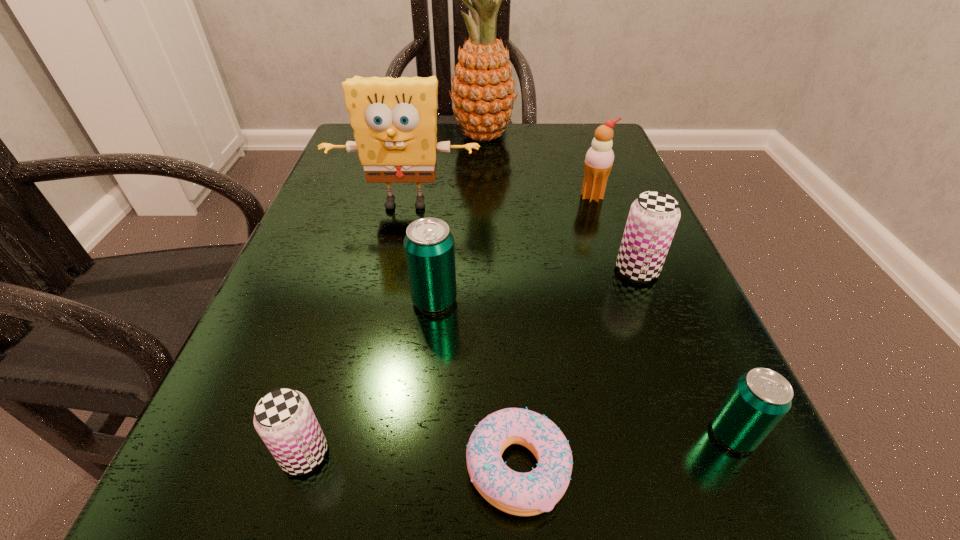
Find the location of a particular element. This screenshot has width=960, height=540. the right teal beer can is located at coordinates (759, 399).

I want to click on the nearer teal beer can, so click(x=759, y=399).

Identify the location of purple doughnut. Image resolution: width=960 pixels, height=540 pixels. [x=522, y=494].

The image size is (960, 540). I want to click on the shortest object, so click(522, 494).

In order to click on vacant space positioned on the front of the farthest object in this screenshot , I will do `click(484, 192)`.

You are a GUI agent. You are given a task and a screenshot of the screen. Output one action in this format:
    pyautogui.click(x=<x>, y=<y>)
    Task: Click on the vacant space located on the face of the second tallest object
    The height and width of the screenshot is (540, 960).
    Given the screenshot: What is the action you would take?
    pyautogui.click(x=385, y=300)

I want to click on free point located 0.280m at the front with a straw on the icecream, so click(x=631, y=310).

At what (x,y) coordinates should I click in order to perform the action: click on vacant space located 0.370m on the left of the right purple beer can. Please return your answer as a coordinate pair (x, y). Looking at the image, I should click on (388, 270).

This screenshot has height=540, width=960. Find the location of `vacant space situated 0.210m on the right of the left teal beer can`. vacant space situated 0.210m on the right of the left teal beer can is located at coordinates (596, 300).

Locate an element on the screen. free region located on the right of the nearer purple beer can is located at coordinates (453, 454).